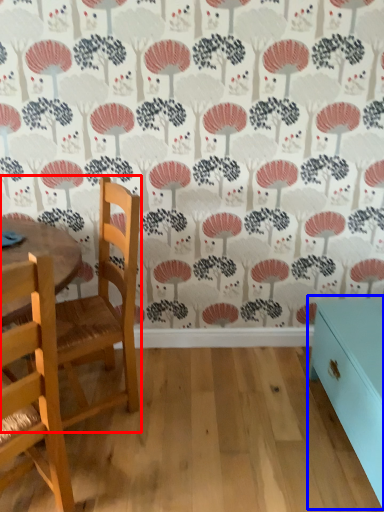
Question: Which object is closer to the camera taking this photo, chair (highlighted by a red box) or table (highlighted by a blue box)?

Choices:
 (A) chair
 (B) table

Answer: (B)